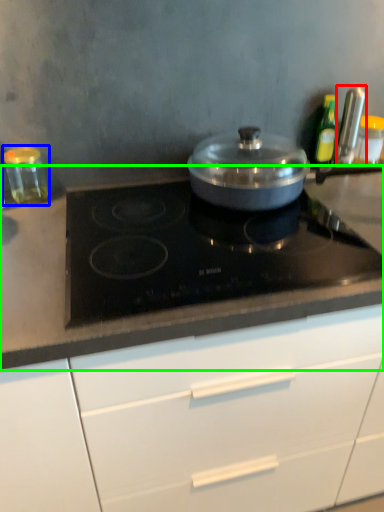
Question: Based on their relative distances, which object is nearer to kitchen appliance (highlighted by a red box)? Choose from kitchen appliance (highlighted by a blue box) and countertop (highlighted by a green box).

Choices:
 (A) kitchen appliance
 (B) countertop

Answer: (B)